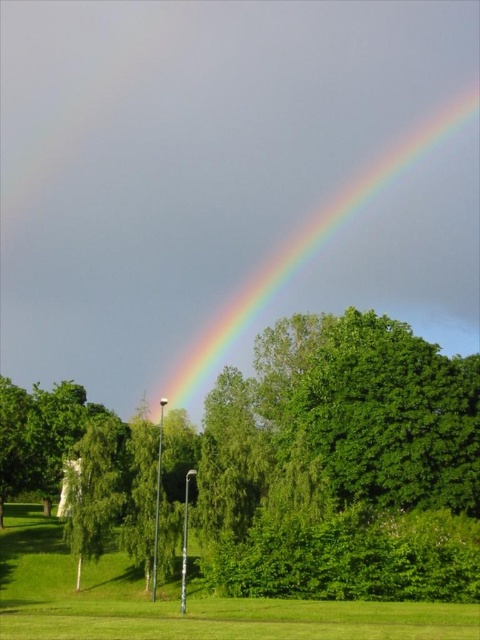
Can you confirm if green grass at lower center is positioned to the left of rainbow at upper center?

Indeed, green grass at lower center is positioned on the left side of rainbow at upper center.

The width and height of the screenshot is (480, 640). What do you see at coordinates (178, 602) in the screenshot? I see `green grass at lower center` at bounding box center [178, 602].

The width and height of the screenshot is (480, 640). In order to click on green grass at lower center in this screenshot , I will do `click(178, 602)`.

Is green leafy tree at center positioned before green grass at lower center?

No.

Which is in front, point (243, 572) or point (122, 556)?

Point (243, 572) is more forward.

Is point (301, 454) farther from camera compared to point (107, 580)?

Yes, it is.

The image size is (480, 640). Identify the location of green leafy tree at center. (334, 467).

Which is more to the right, green leafy tree at center or rainbow at upper center?

Positioned to the right is rainbow at upper center.

In order to click on green leafy tree at center in this screenshot , I will do `click(334, 467)`.